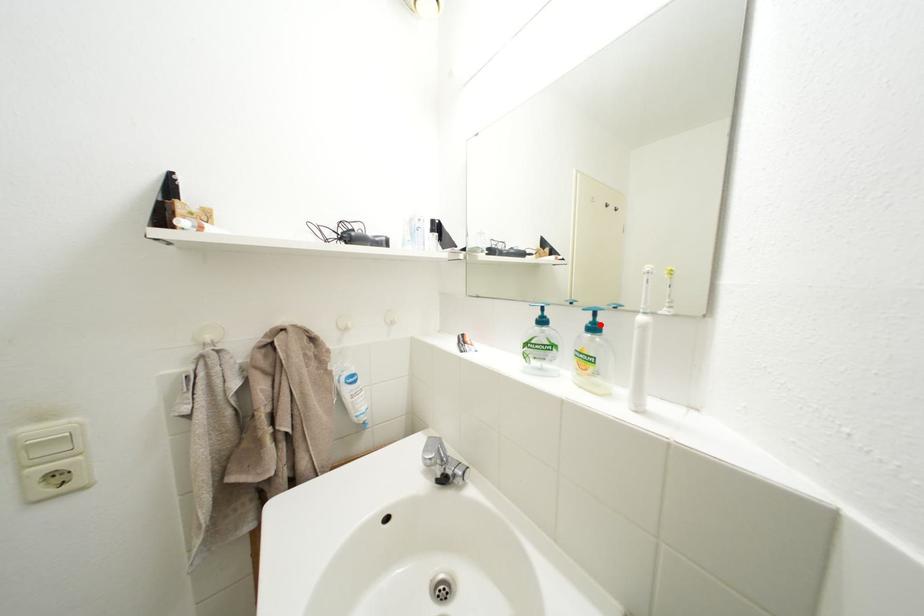
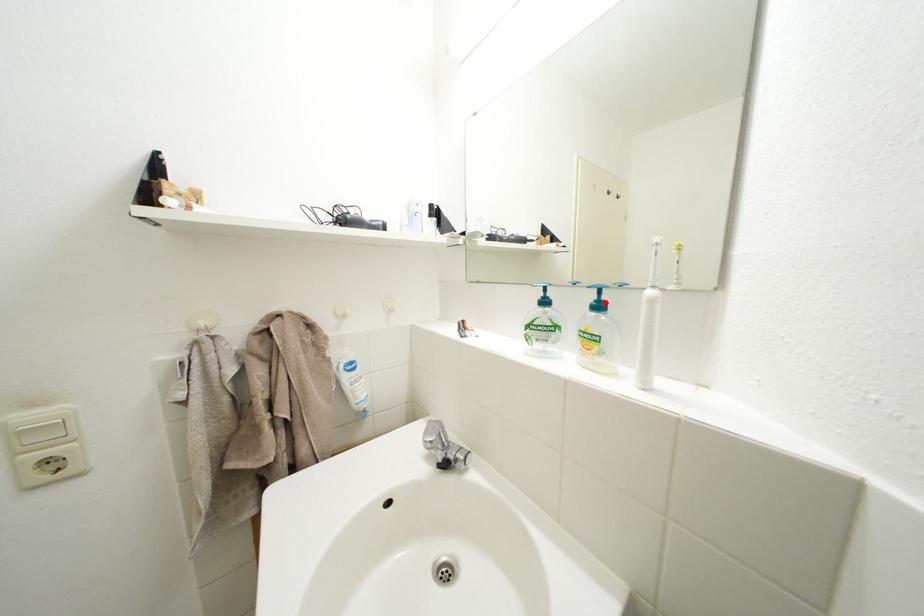
I am providing you with two images of the same scene from different viewpoints. A red point is marked on the first image and another point is marked on the second image. Does the point marked in image1 correspond to the same location as the one in image2?

Yes